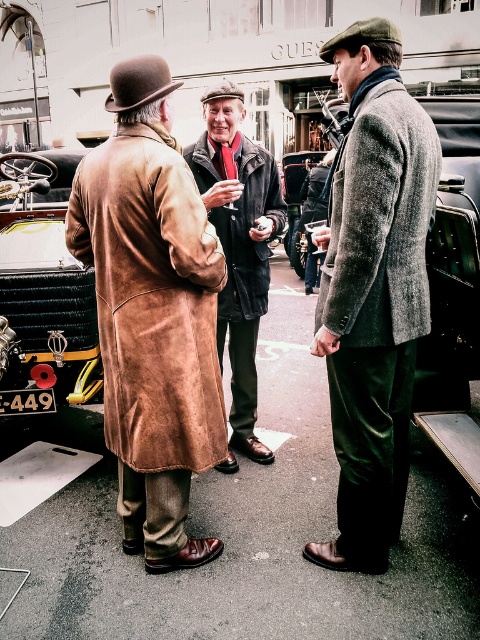
Consider the image. Is brown suede trench coat at left shorter than black plastic license plate at center?

No, brown suede trench coat at left is not shorter than black plastic license plate at center.

Describe the element at coordinates (152, 314) in the screenshot. I see `brown suede trench coat at left` at that location.

The height and width of the screenshot is (640, 480). I want to click on brown suede trench coat at left, so click(x=152, y=314).

Is velvet black coat at center further to the viewer compared to black plastic license plate at center?

No, it is not.

Who is more forward, (229, 268) or (13, 403)?

Point (13, 403) is more forward.

The height and width of the screenshot is (640, 480). What are the coordinates of `velvet black coat at center` in the screenshot? It's located at 238,248.

Can you confirm if textured gray coat at center is positioned below velvet black coat at center?

No, textured gray coat at center is not below velvet black coat at center.

Which is in front, point (380, 269) or point (252, 422)?

Point (380, 269) is more forward.

I want to click on textured gray coat at center, so click(380, 220).